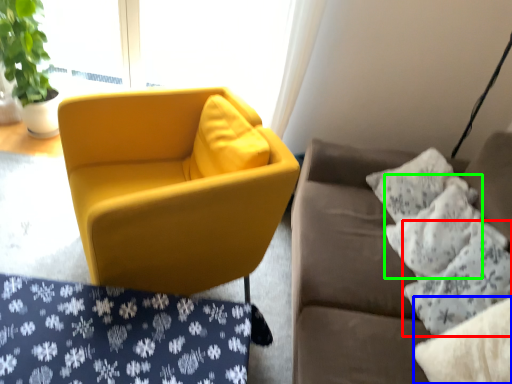
Question: Considering the real-world distances, which object is farthest from pillow (highlighted by a red box)? pillow (highlighted by a blue box) or pillow (highlighted by a green box)?

Choices:
 (A) pillow
 (B) pillow

Answer: (A)